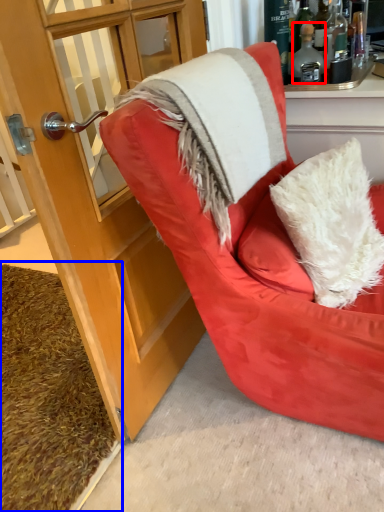
Question: Among these objects, which one is nearest to the camera, bottle (highlighted by a red box) or doormat (highlighted by a blue box)?

Choices:
 (A) bottle
 (B) doormat

Answer: (B)